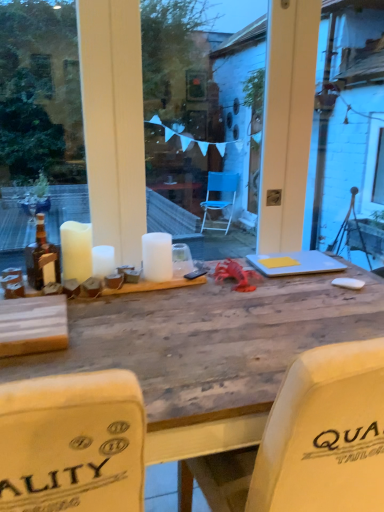
Question: From a real-world perspective, is white matte candle at center, which appears as the 3th candle when viewed from the left, located beneath white matte candle at left, which appears as the first candle when viewed from the left?

Choices:
 (A) no
 (B) yes

Answer: (B)

Question: Does white matte candle at center, which appears as the 3th candle when viewed from the left, appear on the right side of white matte candle at left, acting as the third candle starting from the right?

Choices:
 (A) yes
 (B) no

Answer: (A)

Question: Is white matte candle at center, the 1th candle in the right-to-left sequence, closer to the viewer compared to white matte candle at left, acting as the third candle starting from the right?

Choices:
 (A) yes
 (B) no

Answer: (B)

Question: From the image's perspective, is white matte candle at center, the 1th candle in the right-to-left sequence, located above white matte candle at left, acting as the third candle starting from the right?

Choices:
 (A) no
 (B) yes

Answer: (A)

Question: Is white matte candle at center, which appears as the 3th candle when viewed from the left, looking in the opposite direction of white matte candle at left, acting as the third candle starting from the right?

Choices:
 (A) yes
 (B) no

Answer: (B)

Question: Based on their sizes in the image, would you say white matte candle at left, acting as the third candle starting from the right, is bigger or smaller than transparent glass window at center?

Choices:
 (A) big
 (B) small

Answer: (B)

Question: Is point (59, 227) closer or farther from the camera than point (160, 15)?

Choices:
 (A) closer
 (B) farther

Answer: (A)

Question: From their relative heights in the image, would you say white matte candle at left, which appears as the first candle when viewed from the left, is taller or shorter than transparent glass window at center?

Choices:
 (A) tall
 (B) short

Answer: (B)

Question: Is white matte candle at left, acting as the third candle starting from the right, in front of or behind transparent glass window at center in the image?

Choices:
 (A) behind
 (B) front

Answer: (B)

Question: In terms of size, does white matte candle at left, acting as the third candle starting from the right, appear bigger or smaller than wooden table at center?

Choices:
 (A) small
 (B) big

Answer: (A)

Question: From a real-world perspective, is white matte candle at left, which appears as the first candle when viewed from the left, positioned above or below wooden table at center?

Choices:
 (A) above
 (B) below

Answer: (A)

Question: Relative to wooden table at center, is white matte candle at left, acting as the third candle starting from the right, in front or behind?

Choices:
 (A) behind
 (B) front

Answer: (A)

Question: Looking at their shapes, would you say white matte candle at left, acting as the third candle starting from the right, is wider or thinner than wooden table at center?

Choices:
 (A) thin
 (B) wide

Answer: (A)

Question: Considering the relative positions of matte brown bottle at left and white matte candle at center, which appears as the 3th candle when viewed from the left, in the image provided, is matte brown bottle at left to the left or to the right of white matte candle at center, which appears as the 3th candle when viewed from the left,?

Choices:
 (A) right
 (B) left

Answer: (B)

Question: Which is correct: matte brown bottle at left is inside white matte candle at center, which appears as the 3th candle when viewed from the left, or outside of it?

Choices:
 (A) outside
 (B) inside

Answer: (A)